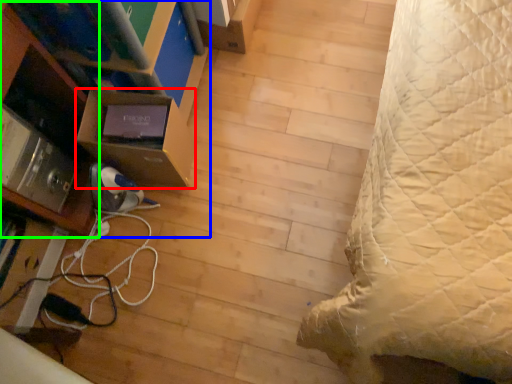
Question: Estimate the real-world distances between objects in this image. Which object is farther from shelf (highlighted by a red box), furniture (highlighted by a blue box) or shelf (highlighted by a green box)?

Choices:
 (A) furniture
 (B) shelf

Answer: (A)